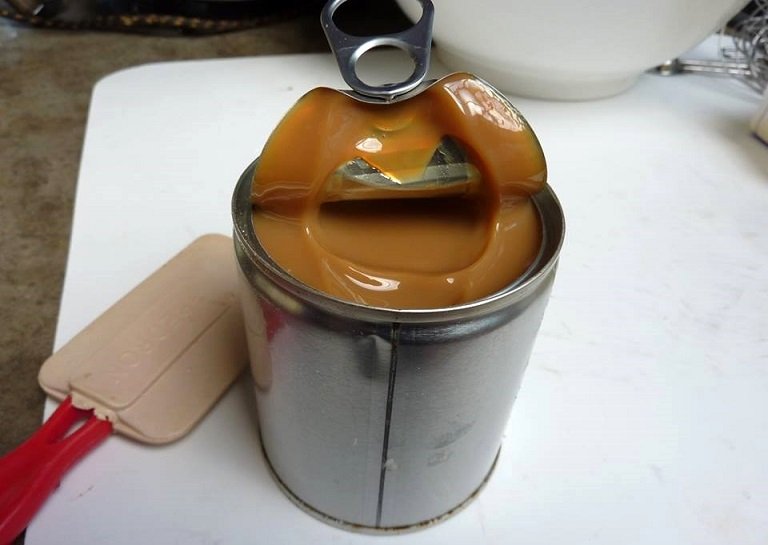
Where is `countertop`? This screenshot has width=768, height=545. countertop is located at coordinates (44, 232).